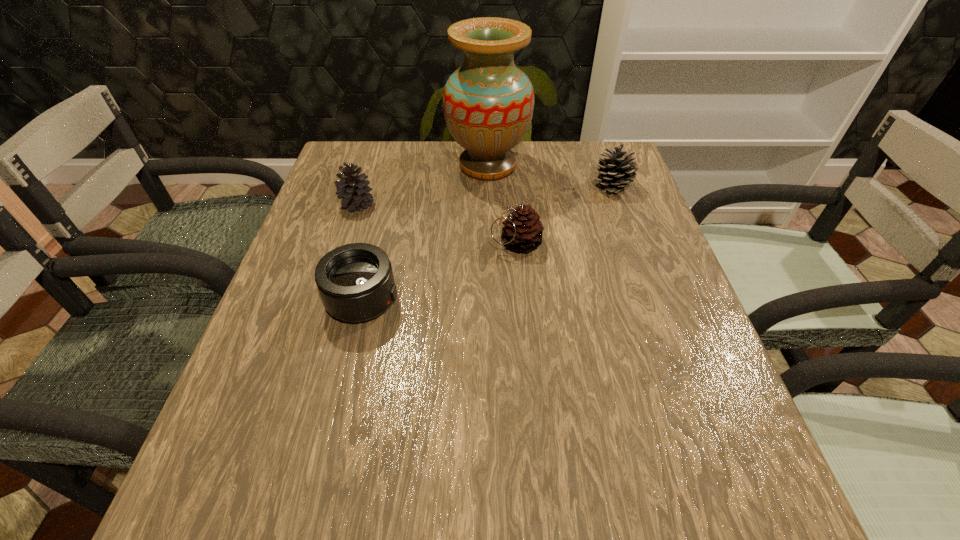
The image size is (960, 540). I want to click on the tallest object, so click(x=488, y=102).

The image size is (960, 540). Find the location of `the leftmost pinecone`. the leftmost pinecone is located at coordinates (353, 191).

Find the location of a particular element. The height and width of the screenshot is (540, 960). the rightmost object is located at coordinates (617, 169).

Locate an element on the screen. Image resolution: width=960 pixels, height=540 pixels. the nearest pinecone is located at coordinates (523, 230).

Identify the location of the second pinecone from right to left. The width and height of the screenshot is (960, 540). (523, 230).

The image size is (960, 540). I want to click on telephoto lens, so pos(356,283).

Identify the location of free space located on the front of the tallest object. This screenshot has width=960, height=540. (490, 252).

Image resolution: width=960 pixels, height=540 pixels. What are the coordinates of `free location located on the front of the leftmost pinecone` in the screenshot? It's located at (340, 258).

Image resolution: width=960 pixels, height=540 pixels. What are the coordinates of `vacant area located 0.310m on the left of the rightmost pinecone` in the screenshot? It's located at (472, 186).

In order to click on free location located with a leaf charm attached to the second pinecone from left to right in this screenshot , I will do `click(339, 242)`.